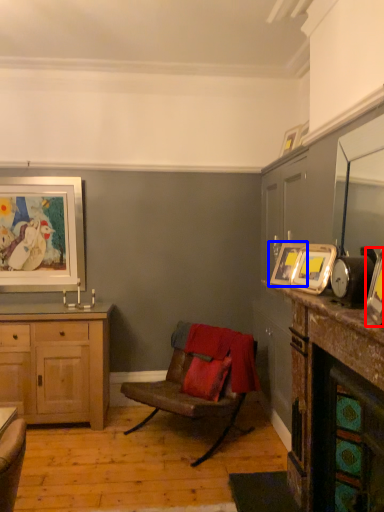
Question: Which of the following is the closest to the observer, picture frame (highlighted by a red box) or picture frame (highlighted by a blue box)?

Choices:
 (A) picture frame
 (B) picture frame

Answer: (A)